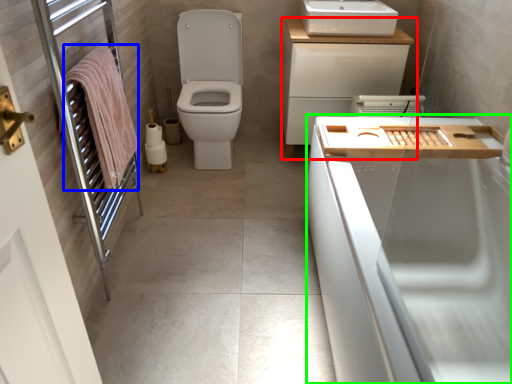
Question: Considering the real-world distances, which object is farthest from bathroom cabinet (highlighted by a red box)? bath towel (highlighted by a blue box) or bath (highlighted by a green box)?

Choices:
 (A) bath towel
 (B) bath

Answer: (A)